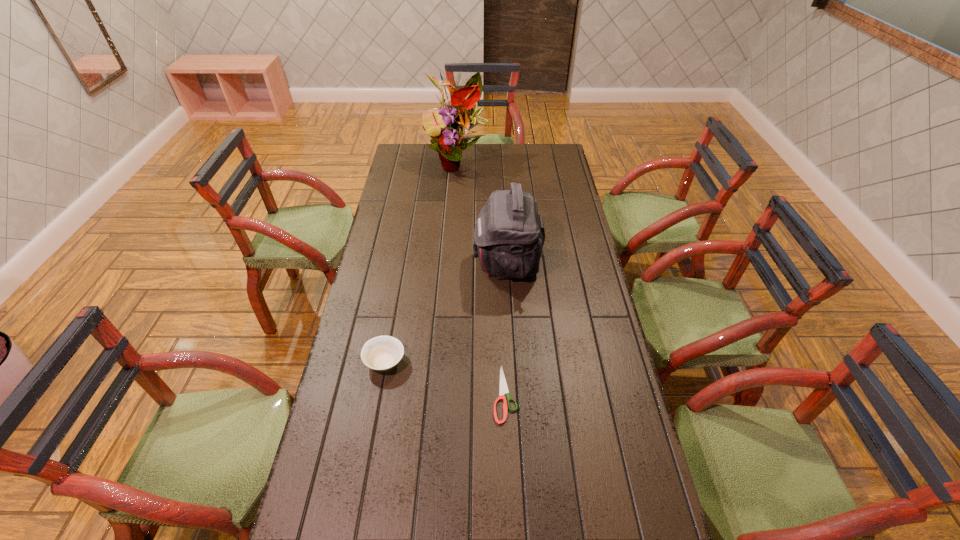
Image resolution: width=960 pixels, height=540 pixels. Find the location of `free space located 0.160m on the front of the third tallest object`. free space located 0.160m on the front of the third tallest object is located at coordinates (372, 431).

Find the location of a particular element. free space located on the right of the scissors is located at coordinates (565, 394).

Identify the location of object that is at the far edge. (460, 118).

At what (x,y) coordinates should I click in order to perform the action: click on bouquet present at the left edge. Please return your answer as a coordinate pair (x, y). Looking at the image, I should click on (460, 118).

The height and width of the screenshot is (540, 960). Find the location of `bowl at the left edge`. bowl at the left edge is located at coordinates (381, 353).

This screenshot has width=960, height=540. I want to click on object situated at the far left corner, so click(460, 118).

This screenshot has width=960, height=540. I want to click on vacant space at the far edge of the desktop, so click(476, 146).

Locate an element on the screen. The width and height of the screenshot is (960, 540). vacant space at the left edge is located at coordinates (356, 395).

In the image, there is a desktop. Identify the location of vacant space at the right edge. Image resolution: width=960 pixels, height=540 pixels. (581, 258).

Find the location of `free space at the far right corner of the desktop`. free space at the far right corner of the desktop is located at coordinates (558, 145).